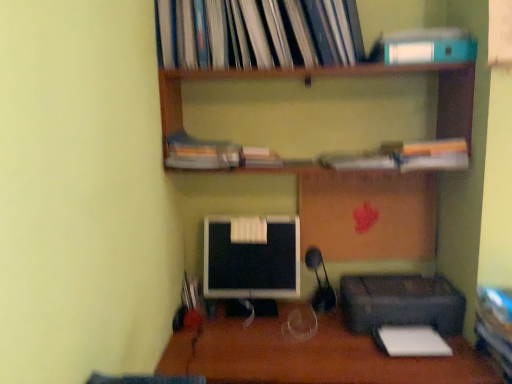
Question: From the image's perspective, relative to wooden desk at center, is black glossy monitor at center above or below?

Choices:
 (A) above
 (B) below

Answer: (A)

Question: Looking at their shapes, would you say black glossy monitor at center is wider or thinner than wooden desk at center?

Choices:
 (A) thin
 (B) wide

Answer: (A)

Question: Based on their relative distances, which object is farther from the hardcover book at upper center, which is the 2th book from top to bottom?

Choices:
 (A) teal matte paperback book at upper right
 (B) hardcover books at upper center, marked as the 4th book in a bottom-to-top arrangement
 (C) wooden desk at center
 (D) black glossy monitor at center
 (E) white paper at lower right

Answer: (E)

Question: Estimate the real-world distances between objects in this image. Which object is farther from the matte plastic book at center, which ranks as the second book in bottom-to-top order?

Choices:
 (A) hardcover books at upper center, marked as the 4th book in a bottom-to-top arrangement
 (B) wooden desk at center
 (C) hardcover book at upper center, which is the 2th book from top to bottom
 (D) hardcover book at center, the 1th book in the bottom-to-top sequence
 (E) black plastic printer at lower right

Answer: (B)